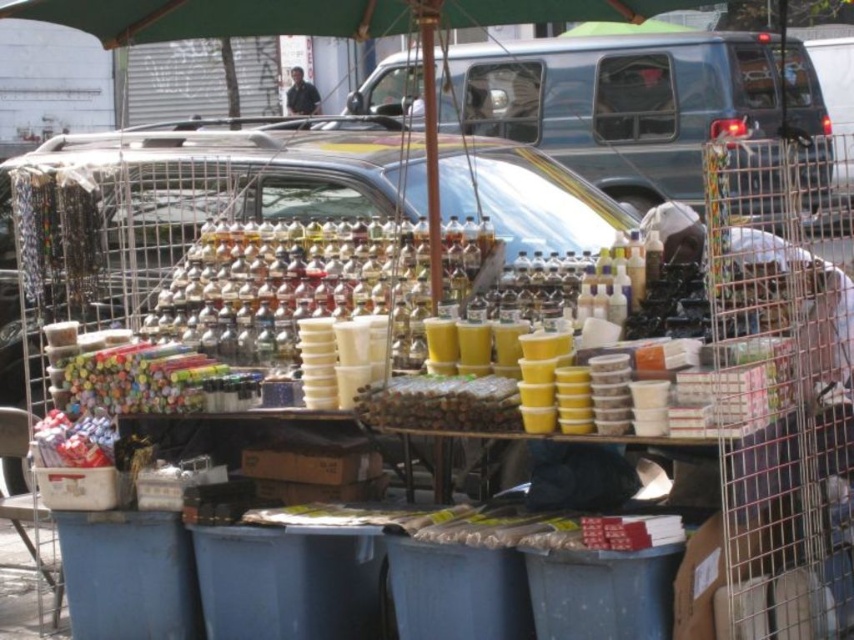
Question: Which object appears farthest from the camera in this image?

Choices:
 (A) dark blue shirt at center
 (B) metallic blue van at center

Answer: (A)

Question: Which point is closer to the camera?

Choices:
 (A) coord(639,122)
 (B) coord(311,109)

Answer: (A)

Question: Does metallic blue van at center have a lesser width compared to dark blue shirt at center?

Choices:
 (A) yes
 (B) no

Answer: (B)

Question: Where is metallic blue van at center located in relation to dark blue shirt at center in the image?

Choices:
 (A) right
 (B) left

Answer: (A)

Question: In this image, where is metallic blue van at center located relative to dark blue shirt at center?

Choices:
 (A) right
 (B) left

Answer: (A)